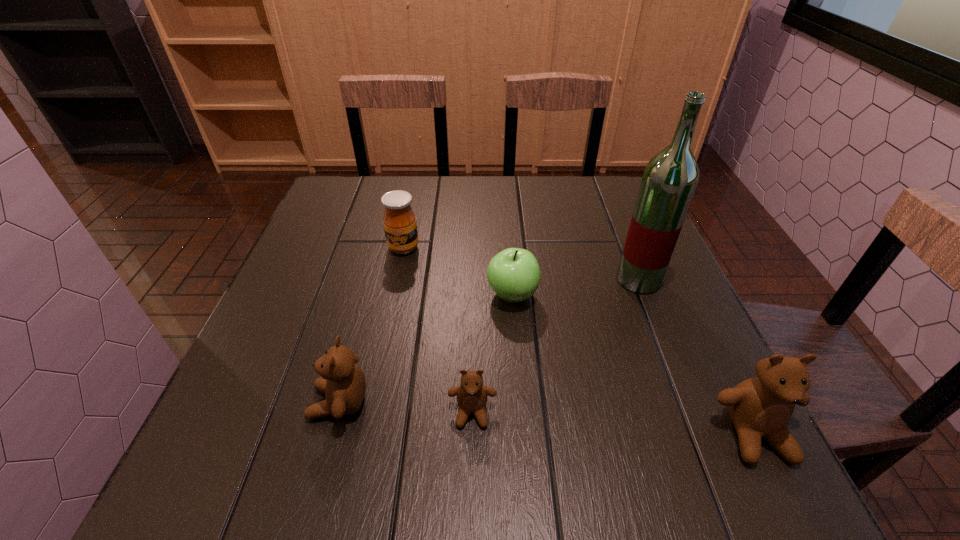
Identify the location of vacant space positioned on the right of the apple. This screenshot has height=540, width=960. (588, 295).

I want to click on vacant area located 0.280m on the front-facing side of the farthest object, so click(x=383, y=349).

Where is `object that is at the left edge`? This screenshot has width=960, height=540. object that is at the left edge is located at coordinates (342, 381).

This screenshot has height=540, width=960. In order to click on teddy bear that is positioned at the right edge in this screenshot , I will do `click(760, 407)`.

The height and width of the screenshot is (540, 960). I want to click on liquor that is at the right edge, so click(670, 178).

Identify the location of object that is at the near left corner. (342, 381).

You are a GUI agent. You are given a task and a screenshot of the screen. Output one action in this format:
    pyautogui.click(x=<x>, y=<y>)
    Task: Click on the object situated at the near right corner
    The height and width of the screenshot is (540, 960).
    Given the screenshot: What is the action you would take?
    pyautogui.click(x=760, y=407)

Where is `vacant space at the far edge of the desktop`? This screenshot has height=540, width=960. vacant space at the far edge of the desktop is located at coordinates (447, 188).

In the image, there is a desktop. Where is `vacant space at the left edge`? vacant space at the left edge is located at coordinates (327, 274).

Locate an element on the screen. This screenshot has height=540, width=960. blank space at the right edge of the desktop is located at coordinates (683, 358).